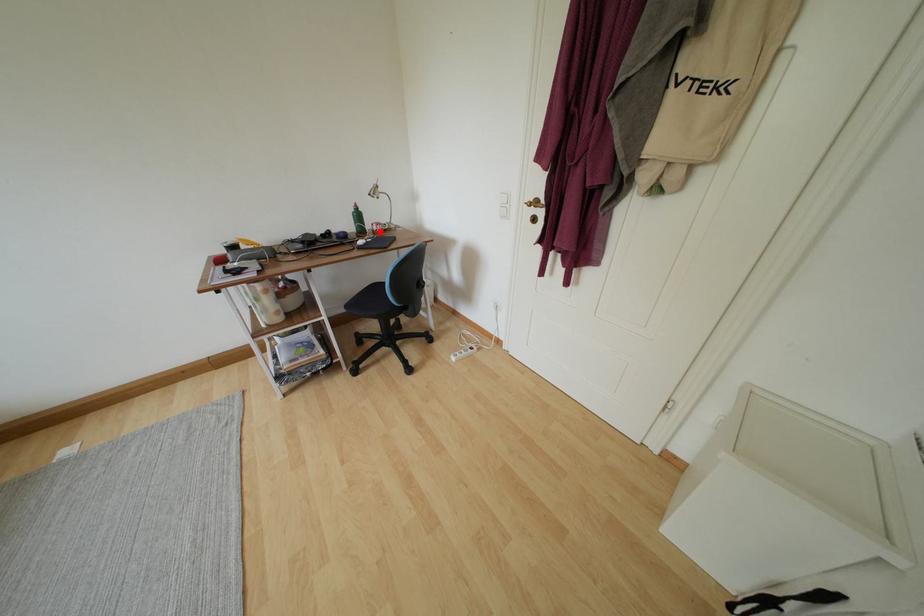
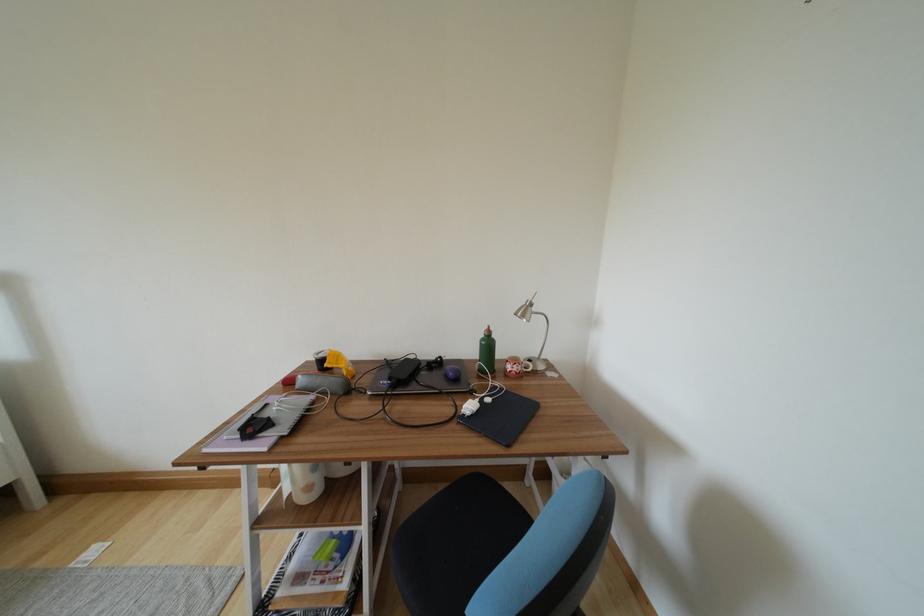
The point at the highlighted location is marked in the first image. Where is the corresponding point in the second image?

(514, 371)